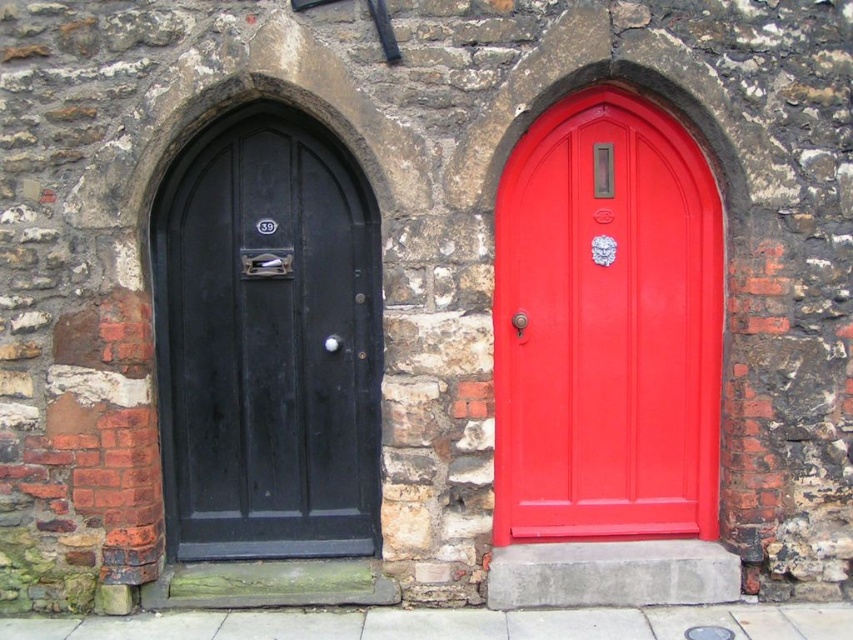
From the picture: Does glossy wood door at upper center appear on the left side of matte black door at left?

Incorrect, glossy wood door at upper center is not on the left side of matte black door at left.

Does glossy wood door at upper center come in front of matte black door at left?

Yes, it is in front of matte black door at left.

What do you see at coordinates (606, 326) in the screenshot? I see `glossy wood door at upper center` at bounding box center [606, 326].

Find the location of a particular element. glossy wood door at upper center is located at coordinates (606, 326).